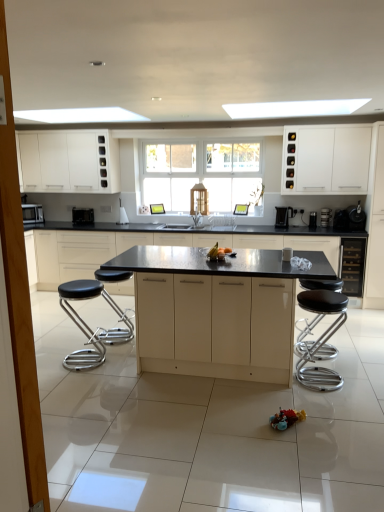
The width and height of the screenshot is (384, 512). What do you see at coordinates (321, 338) in the screenshot? I see `black chrome bar stool at right, arranged as the first bar stool when viewed from the right` at bounding box center [321, 338].

What do you see at coordinates (82, 324) in the screenshot?
I see `black leather stool at left, acting as the 2th bar stool starting from the right` at bounding box center [82, 324].

The image size is (384, 512). What do you see at coordinates (283, 216) in the screenshot?
I see `black plastic coffee machine at center, arranged as the 2th coffee machine when viewed from the right` at bounding box center [283, 216].

Identify the location of black plastic coffee machine at right, placed as the second coffee machine when sorted from left to right. (326, 217).

Identify the location of black plastic coffee maker at center right, which is the 3th appliance in left-to-right order. (313, 220).

The width and height of the screenshot is (384, 512). Identify the location of metallic microwave at left, which is the 4th appliance from right to left. (82, 216).

This screenshot has height=512, width=384. Identify the location of yellow banana peel at center. (218, 253).

Locate an element on the screen. The width and height of the screenshot is (384, 512). black chrome bar stool at right, arranged as the first bar stool when viewed from the right is located at coordinates (321, 338).

Is white matte cabinet at right, which is the fifth cabinetry in back-to-front order, completely or partially outside of black glass wine cooler at right, arranged as the second appliance when viewed from the right?

Yes, white matte cabinet at right, which is the fifth cabinetry in back-to-front order, is outside of black glass wine cooler at right, arranged as the second appliance when viewed from the right.

Can you confirm if white matte cabinet at right, which is the fifth cabinetry in back-to-front order, is thinner than black glass wine cooler at right, which is the fourth appliance in left-to-right order?

No.

From a real-world perspective, is white matte cabinet at right, the 2th cabinetry viewed from the front, on black glass wine cooler at right, which is the fourth appliance in left-to-right order?

Yes, from a real-world perspective, white matte cabinet at right, the 2th cabinetry viewed from the front, is above black glass wine cooler at right, which is the fourth appliance in left-to-right order.

Is point (365, 291) closer or farther from the camera than point (334, 220)?

Point (365, 291) appears to be closer to the viewer than point (334, 220).

From the image's perspective, is black matte coffee maker at right, the 1th appliance viewed from the right, on top of matte black countertop at center, which is the third cabinetry from back to front?

Correct, black matte coffee maker at right, the 1th appliance viewed from the right, appears higher than matte black countertop at center, which is the third cabinetry from back to front, in the image.

Considering the positions of point (348, 226) and point (122, 248), is point (348, 226) closer or farther from the camera than point (122, 248)?

Point (348, 226) appears to be closer to the viewer than point (122, 248).

Does black matte coffee maker at right, the fifth appliance when ordered from left to right, contain matte black countertop at center, which is the third cabinetry from back to front?

No, matte black countertop at center, which is the third cabinetry from back to front, is not a part of black matte coffee maker at right, the fifth appliance when ordered from left to right.

Image resolution: width=384 pixels, height=512 pixels. Find the location of `coffee machine that is the 2nd one when counting downward from the metallic microwave at left, the second appliance positioned from the left (from the image's perspective)`. coffee machine that is the 2nd one when counting downward from the metallic microwave at left, the second appliance positioned from the left (from the image's perspective) is located at coordinates (326, 217).

From a real-world perspective, is metallic microwave at left, which is the 4th appliance from right to left, above or below black plastic coffee machine at right, the first coffee machine viewed from the right?

In terms of real-world spatial position, metallic microwave at left, which is the 4th appliance from right to left, is below black plastic coffee machine at right, the first coffee machine viewed from the right.

Does point (73, 223) lie behind point (331, 222)?

Yes, it is.

Considering the sizes of objects metallic microwave at left, which is the 4th appliance from right to left, and black plastic coffee machine at right, the first coffee machine viewed from the right, in the image provided, who is wider, metallic microwave at left, which is the 4th appliance from right to left, or black plastic coffee machine at right, the first coffee machine viewed from the right,?

metallic microwave at left, which is the 4th appliance from right to left, is wider.

Is black leather stool at left, acting as the 2th bar stool starting from the right, located within matte black countertop at center, arranged as the first cabinetry when viewed from the front?

No, matte black countertop at center, arranged as the first cabinetry when viewed from the front, does not contain black leather stool at left, acting as the 2th bar stool starting from the right.

Considering the positions of point (264, 290) and point (87, 349), is point (264, 290) closer or farther from the camera than point (87, 349)?

Point (264, 290) is closer to the camera than point (87, 349).

Between matte black countertop at center, arranged as the first cabinetry when viewed from the front, and black leather stool at left, marked as the first bar stool in a left-to-right arrangement, which one is positioned in front?

matte black countertop at center, arranged as the first cabinetry when viewed from the front.

Based on the photo, is black chrome bar stool at right, arranged as the first bar stool when viewed from the right, positioned beyond the bounds of matte black countertop at center, arranged as the first cabinetry when viewed from the front?

Actually, black chrome bar stool at right, arranged as the first bar stool when viewed from the right, is at least partially inside matte black countertop at center, arranged as the first cabinetry when viewed from the front.

Can you tell me how much black chrome bar stool at right, arranged as the first bar stool when viewed from the right, and matte black countertop at center, positioned as the sixth cabinetry in back-to-front order, differ in facing direction?

0.438 degrees separate the facing orientations of black chrome bar stool at right, arranged as the first bar stool when viewed from the right, and matte black countertop at center, positioned as the sixth cabinetry in back-to-front order.

From a real-world perspective, which object stands above the other?

From a 3D spatial view, matte black countertop at center, arranged as the first cabinetry when viewed from the front, is above.

From the image's perspective, is black chrome bar stool at right, positioned as the 2th bar stool in left-to-right order, below matte black countertop at center, positioned as the sixth cabinetry in back-to-front order?

Correct, black chrome bar stool at right, positioned as the 2th bar stool in left-to-right order, appears lower than matte black countertop at center, positioned as the sixth cabinetry in back-to-front order, in the image.

In the scene shown: Could you tell me if wooden screen door at left is turned towards yellow banana peel at center?

No.

Based on their positions, is wooden screen door at left located to the left or right of yellow banana peel at center?

In the image, wooden screen door at left appears on the left side of yellow banana peel at center.

Considering the relative sizes of wooden screen door at left and yellow banana peel at center in the image provided, is wooden screen door at left smaller than yellow banana peel at center?

No, wooden screen door at left is not smaller than yellow banana peel at center.

Considering the relative sizes of wooden screen door at left and yellow banana peel at center in the image provided, is wooden screen door at left taller than yellow banana peel at center?

Correct, wooden screen door at left is much taller as yellow banana peel at center.

Is point (100, 289) more distant than point (363, 215)?

No, (100, 289) is in front of (363, 215).

From a real-world perspective, which object stands above the other?

In real-world perspective, black matte coffee maker at right, the fifth appliance when ordered from left to right, is above.

Is black leather stool at left, acting as the 2th bar stool starting from the right, in front of black matte coffee maker at right, the 1th appliance viewed from the right?

Yes, black leather stool at left, acting as the 2th bar stool starting from the right, is in front of black matte coffee maker at right, the 1th appliance viewed from the right.

From the image's perspective, is black leather stool at left, acting as the 2th bar stool starting from the right, located beneath black matte coffee maker at right, the fifth appliance when ordered from left to right?

Indeed, from the image's perspective, black leather stool at left, acting as the 2th bar stool starting from the right, is shown beneath black matte coffee maker at right, the fifth appliance when ordered from left to right.

The width and height of the screenshot is (384, 512). What are the coordinates of `the 4th cabinetry in front of the black glass wine cooler at right, arranged as the second appliance when viewed from the right, starting your count from the anchor` in the screenshot? It's located at (375, 223).

I want to click on the 4th cabinetry below the black matte coffee maker at right, the fifth appliance when ordered from left to right (from a real-world perspective), so click(157, 243).

Which object lies nearer to the anchor point wooden screen door at left, black leather stool at left, acting as the 2th bar stool starting from the right, or black glass wine cooler at right, the fifth cabinetry from the front?

black leather stool at left, acting as the 2th bar stool starting from the right.

Estimate the real-world distances between objects in this image. Which object is further from matte black microwave at left, the fifth appliance from the right, matte black countertop at center, which is the third cabinetry from back to front, or white matte cabinet at upper right, the fourth cabinetry from the back?

The object further to matte black microwave at left, the fifth appliance from the right, is white matte cabinet at upper right, the fourth cabinetry from the back.

Looking at the image, which one is located closer to black chrome bar stool at right, positioned as the 2th bar stool in left-to-right order, black glass wine cooler at right, the fifth cabinetry from the front, or yellow banana peel at center?

yellow banana peel at center is closer to black chrome bar stool at right, positioned as the 2th bar stool in left-to-right order.

Estimate the real-world distances between objects in this image. Which object is closer to yellow banana peel at center, wooden screen door at left or black matte coffee maker at right, the 1th appliance viewed from the right?

black matte coffee maker at right, the 1th appliance viewed from the right, is closer to yellow banana peel at center.

When comparing their distances from wooden screen door at left, does black matte coffee maker at right, the fifth appliance when ordered from left to right, or black glass wine cooler at right, which is the fourth appliance in left-to-right order, seem further?

black glass wine cooler at right, which is the fourth appliance in left-to-right order, lies further to wooden screen door at left than the other object.

From the image, which object appears to be nearer to black matte coffee maker at right, the 1th appliance viewed from the right, black glass wine cooler at right, which is the fourth appliance in left-to-right order, or metallic microwave at left, the second appliance positioned from the left?

black glass wine cooler at right, which is the fourth appliance in left-to-right order, is closer to black matte coffee maker at right, the 1th appliance viewed from the right.

Estimate the real-world distances between objects in this image. Which object is further from black plastic coffee machine at center, the 1th coffee machine in the left-to-right sequence, metallic microwave at left, which is the 4th appliance from right to left, or black chrome bar stool at right, positioned as the 2th bar stool in left-to-right order?

Based on the image, metallic microwave at left, which is the 4th appliance from right to left, appears to be further to black plastic coffee machine at center, the 1th coffee machine in the left-to-right sequence.

Considering their positions, is yellow banana peel at center positioned further to black matte coffee maker at right, the fifth appliance when ordered from left to right, than matte black microwave at left, the fifth appliance from the right?

matte black microwave at left, the fifth appliance from the right, is positioned further to the anchor black matte coffee maker at right, the fifth appliance when ordered from left to right.

This screenshot has width=384, height=512. Identify the location of coffee machine situated between white matte cabinet at upper left, marked as the sixth cabinetry in a front-to-back arrangement, and white matte cabinet at upper right, the fourth cabinetry from the back, from left to right. (283, 216).

I want to click on food between white matte cabinet at upper left, which appears as the 1th cabinetry when viewed from the back, and black glass wine cooler at right, the fifth cabinetry from the front, so click(x=218, y=253).

Where is `food between metallic microwave at left, the second appliance positioned from the left, and black glass wine cooler at right, which is the second cabinetry from back to front, from left to right`? food between metallic microwave at left, the second appliance positioned from the left, and black glass wine cooler at right, which is the second cabinetry from back to front, from left to right is located at coordinates (218, 253).

What are the coordinates of `cabinetry located between wooden screen door at left and white matte cabinet at right, which is the fifth cabinetry in back-to-front order, in the depth direction` in the screenshot? It's located at (215, 326).